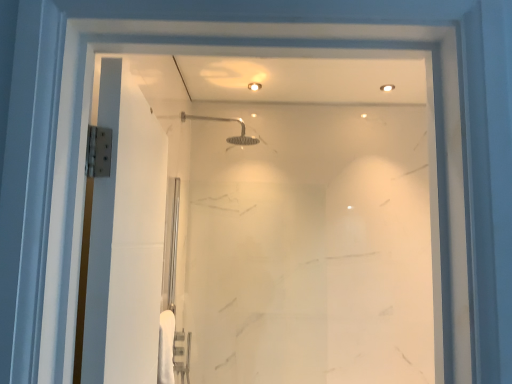
Question: Is transparent glass door at center inside or outside of satin nickel shower head at upper center?

Choices:
 (A) inside
 (B) outside

Answer: (B)

Question: In the image, is transparent glass door at center positioned in front of or behind satin nickel shower head at upper center?

Choices:
 (A) behind
 (B) front

Answer: (B)

Question: From the image's perspective, is transparent glass door at center above or below satin nickel shower head at upper center?

Choices:
 (A) below
 (B) above

Answer: (A)

Question: Is satin nickel shower head at upper center in front of or behind transparent glass door at center in the image?

Choices:
 (A) behind
 (B) front

Answer: (A)

Question: Is satin nickel shower head at upper center inside the boundaries of transparent glass door at center, or outside?

Choices:
 (A) inside
 (B) outside

Answer: (B)

Question: Is point (239, 140) closer or farther from the camera than point (196, 152)?

Choices:
 (A) closer
 (B) farther

Answer: (A)

Question: In terms of width, does satin nickel shower head at upper center look wider or thinner when compared to transparent glass door at center?

Choices:
 (A) wide
 (B) thin

Answer: (A)